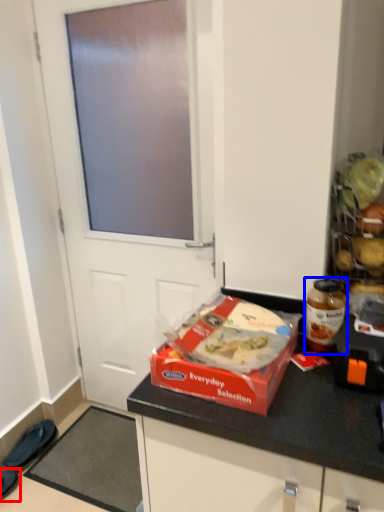
Question: Among these objects, which one is farthest to the camera, footwear (highlighted by a red box) or bottle (highlighted by a blue box)?

Choices:
 (A) footwear
 (B) bottle

Answer: (A)